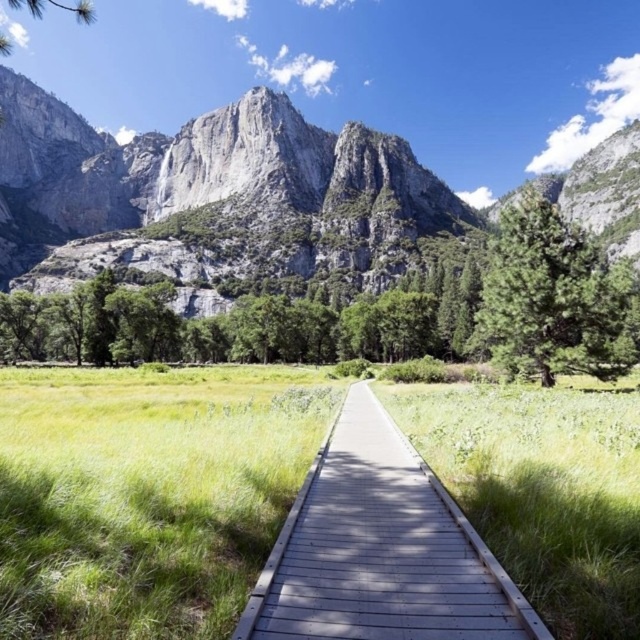
You are standing at the starting point of the wooden boardwalk and want to reach a destination located at point (256, 584). There is an obstacle at point (628, 243). Will you encounter the obstacle before reaching your destination?

Point (628, 243) is further to the camera than point (256, 584), so you will encounter the obstacle at point (628, 243) before reaching your destination at point (256, 584).

You are standing on the wooden boardwalk at center and want to take a photo of the gray rock mountain at center. In which direction should you point your camera to capture the mountain?

You should point your camera to the left since the gray rock mountain at center is located to the left of the wooden boardwalk at center.